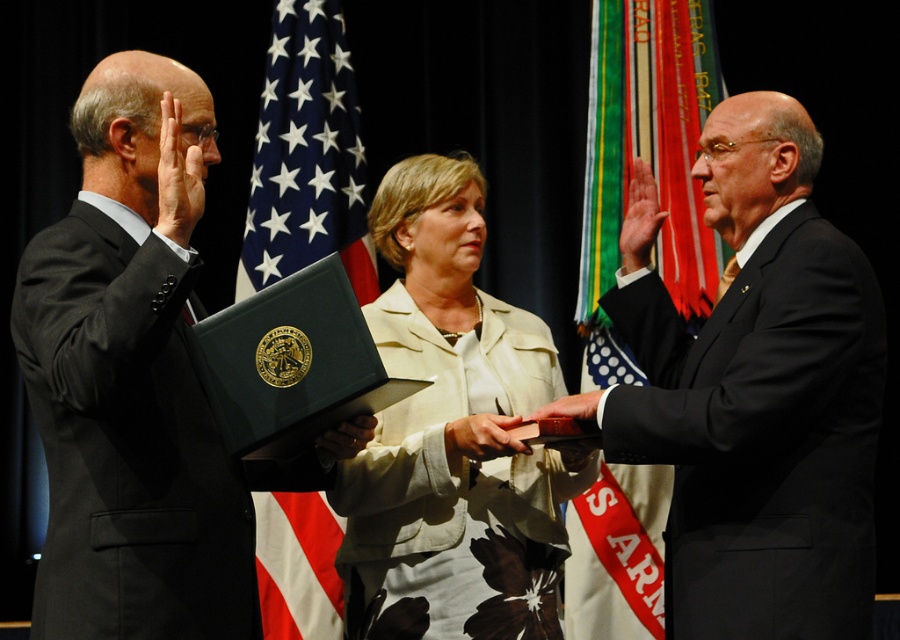
Is beige fabric jacket at center to the left of green fabric flag at center from the viewer's perspective?

Indeed, beige fabric jacket at center is positioned on the left side of green fabric flag at center.

Is beige fabric jacket at center taller than green fabric flag at center?

No, beige fabric jacket at center is not taller than green fabric flag at center.

Where is `beige fabric jacket at center`? beige fabric jacket at center is located at coordinates (452, 435).

Who is lower down, black suit at center or green fabric flag at center?

green fabric flag at center is lower down.

Which is above, black suit at center or green fabric flag at center?

black suit at center is higher up.

Does point (624, 328) come behind point (648, 582)?

No, (624, 328) is closer to viewer.

Find the location of a particular element. black suit at center is located at coordinates (754, 392).

Which is more to the left, green fabric flag at center or blue fabric flag at center?

blue fabric flag at center

Who is positioned more to the right, green fabric flag at center or blue fabric flag at center?

green fabric flag at center

Is point (644, 529) less distant than point (279, 49)?

That is True.

Identify the location of green fabric flag at center. (648, 161).